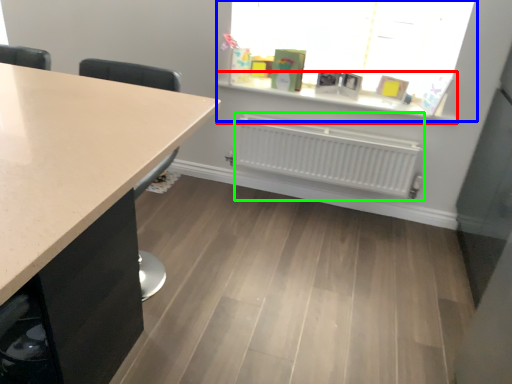
Question: Based on their relative distances, which object is nearer to window sill (highlighted by a red box)? Choose from window (highlighted by a blue box) and radiator (highlighted by a green box).

Choices:
 (A) window
 (B) radiator

Answer: (A)